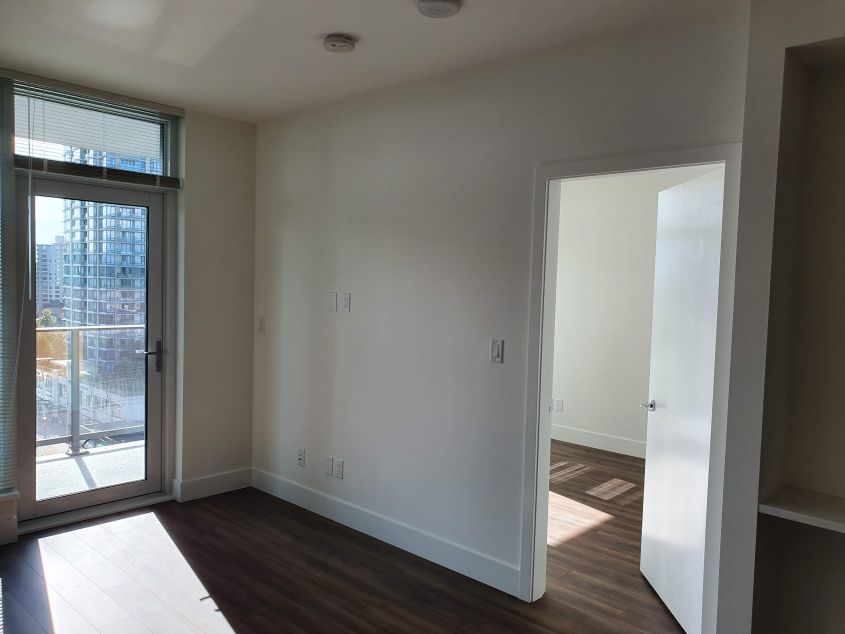
Image resolution: width=845 pixels, height=634 pixels. I want to click on doors, so click(x=679, y=410), click(x=154, y=369), click(x=31, y=358).